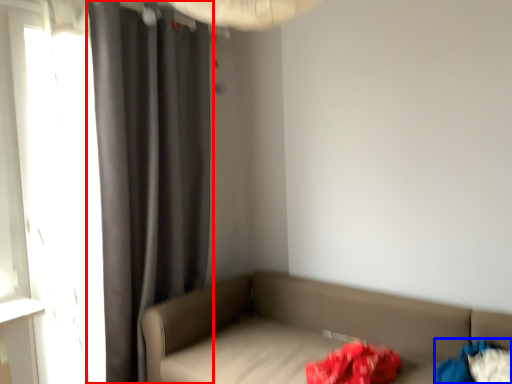
Question: Among these objects, which one is farthest to the camera, curtain (highlighted by a red box) or clothing (highlighted by a blue box)?

Choices:
 (A) curtain
 (B) clothing

Answer: (A)